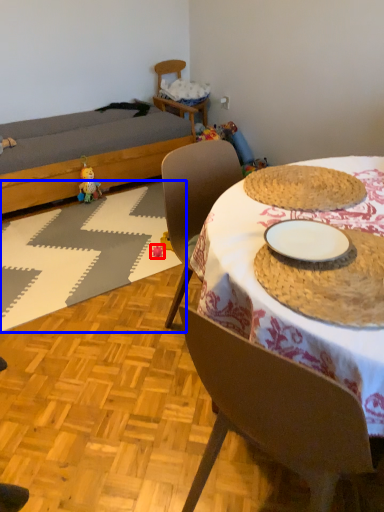
Question: Which object appears closest to the camera in this image, toy (highlighted by a red box) or place mat (highlighted by a blue box)?

Choices:
 (A) toy
 (B) place mat

Answer: (B)